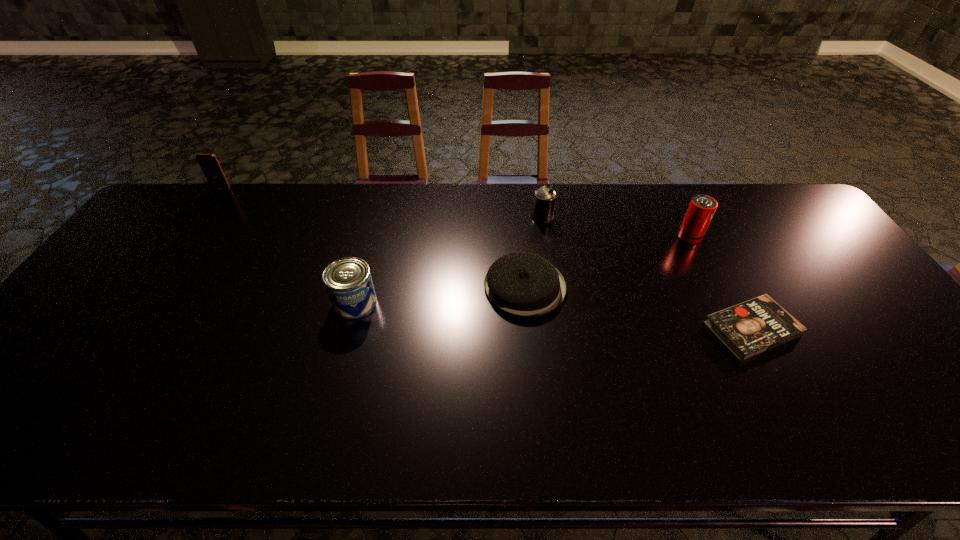
Where is `the farthest object`? the farthest object is located at coordinates [209, 164].

Find the location of `the leftmost object`. the leftmost object is located at coordinates (209, 164).

You are a GUI agent. You are given a task and a screenshot of the screen. Output one action in this format:
    pyautogui.click(x=<x>, y=<y>)
    Task: Click on the second nearest can
    The image size is (960, 540).
    Given the screenshot: What is the action you would take?
    pyautogui.click(x=701, y=209)

The image size is (960, 540). What are the coordinates of `the third farthest object` in the screenshot? It's located at (701, 209).

Locate an element on the screen. This screenshot has height=540, width=960. the farthest can is located at coordinates (544, 202).

The height and width of the screenshot is (540, 960). In order to click on the fifth nearest object in this screenshot , I will do `click(544, 202)`.

The width and height of the screenshot is (960, 540). Find the location of `the nearest can`. the nearest can is located at coordinates (348, 282).

This screenshot has height=540, width=960. Find the location of `the leftmost can`. the leftmost can is located at coordinates (348, 282).

Identify the location of the fifth tallest object. This screenshot has width=960, height=540. (522, 284).

Find the location of a particular element. book is located at coordinates 750,328.